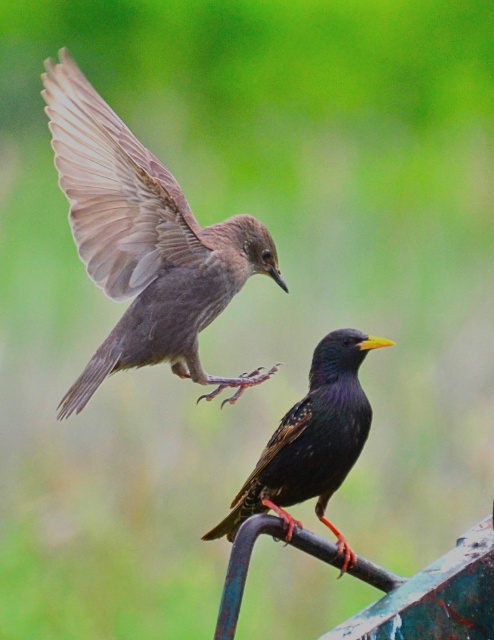
You are a birdwatcher observing the scene. You notice the brown feathered wing at upper left and the shiny black bird at center. Which object is positioned higher in the image?

The brown feathered wing at upper left is positioned higher than the shiny black bird at center.

You are standing in the scene and want to locate the brown feathered bird at upper left. What are the coordinates to find it?

The coordinates to find the brown feathered bird at upper left are point (143, 241).